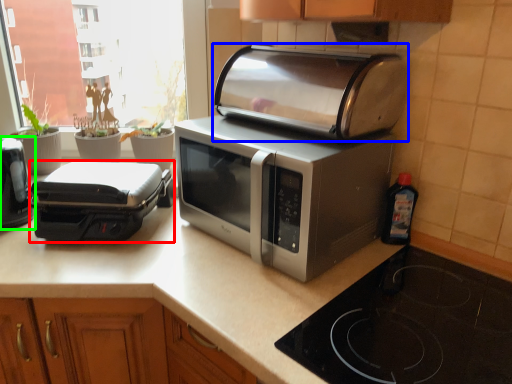
Question: Considering the real-world distances, which object is farthest from toaster (highlighted by a red box)? toaster (highlighted by a blue box) or toaster (highlighted by a green box)?

Choices:
 (A) toaster
 (B) toaster

Answer: (A)